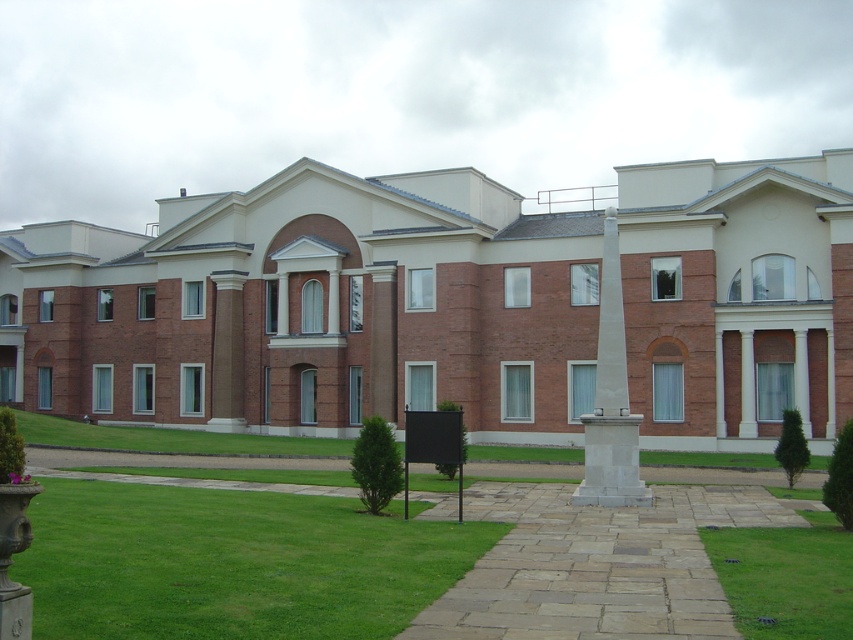
Can you confirm if green grass at center is positioned above white marble obelisk at center?

Incorrect, green grass at center is not positioned above white marble obelisk at center.

Is green grass at center further to the viewer compared to white marble obelisk at center?

No.

Locate an element on the screen. This screenshot has height=640, width=853. green grass at center is located at coordinates (785, 577).

Which is in front, point (55, 552) or point (602, 426)?

Point (55, 552) is in front.

How much distance is there between green grass at lower left and white marble obelisk at center?

green grass at lower left and white marble obelisk at center are 27.53 feet apart.

Measure the distance between point (91, 486) and camera.

Point (91, 486) is 17.90 meters from camera.

Identify the location of green grass at lower left. The height and width of the screenshot is (640, 853). (231, 563).

Does green grass at lower left appear on the left side of green grass at center?

Correct, you'll find green grass at lower left to the left of green grass at center.

Can you confirm if green grass at lower left is positioned to the right of green grass at center?

In fact, green grass at lower left is to the left of green grass at center.

Identify the location of green grass at lower left. (231, 563).

You are a GUI agent. You are given a task and a screenshot of the screen. Output one action in this format:
    pyautogui.click(x=<x>, y=<y>)
    Task: Click on the green grass at lower left
    
    Given the screenshot: What is the action you would take?
    pyautogui.click(x=231, y=563)